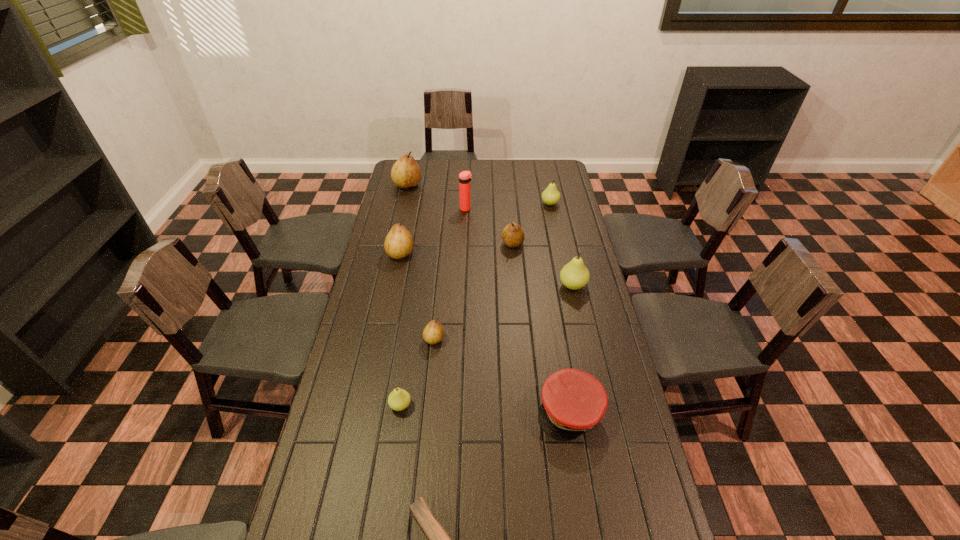
Where is `vacant space at the far right corner`? vacant space at the far right corner is located at coordinates (538, 160).

What are the coordinates of `blank region between the second nearest pear and the farthest pear` in the screenshot? It's located at (420, 262).

I want to click on vacant space that is in between the farthest green pear and the third smallest brown pear, so click(x=475, y=228).

Find the location of a particular element. The image size is (960, 540). free space between the second biggest brown pear and the red cap is located at coordinates (485, 332).

Where is `empty location between the second biggest green pear and the red cap`? This screenshot has width=960, height=540. empty location between the second biggest green pear and the red cap is located at coordinates 560,307.

Find the location of a particular element. unoccupied position between the second brown pear from right to left and the third biggest brown pear is located at coordinates (473, 292).

The width and height of the screenshot is (960, 540). Find the location of `unoccupied area between the smallest green pear and the thermos bottle`. unoccupied area between the smallest green pear and the thermos bottle is located at coordinates (433, 307).

Locate an element on the screen. The image size is (960, 540). vacant area between the eighth object from right to left and the cap is located at coordinates (485, 408).

Locate an element on the screen. The image size is (960, 540). free space between the biggest green pear and the thermos bottle is located at coordinates (519, 247).

Find the location of `object that ranks as the seventh closest to the third smallest brown pear`. object that ranks as the seventh closest to the third smallest brown pear is located at coordinates (550, 196).